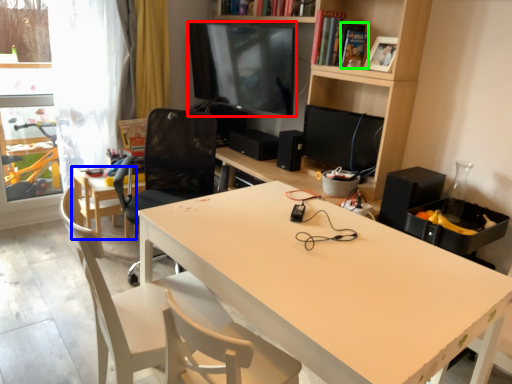
Question: Estimate the real-world distances between objects in this image. Which object is farther from television (highlighted by a red box), chair (highlighted by a blue box) or book (highlighted by a green box)?

Choices:
 (A) chair
 (B) book

Answer: (A)